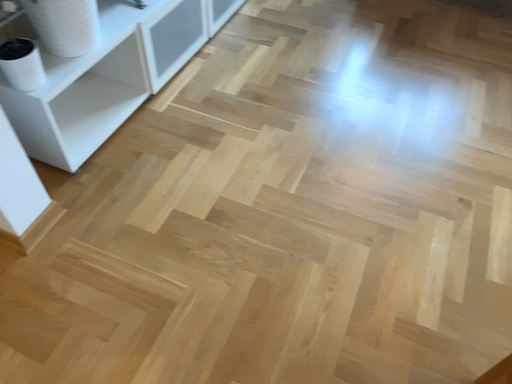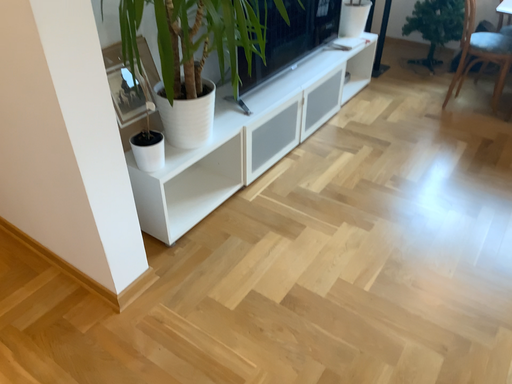
Question: How did the camera likely rotate when shooting the video?

Choices:
 (A) rotated right
 (B) rotated left

Answer: (B)